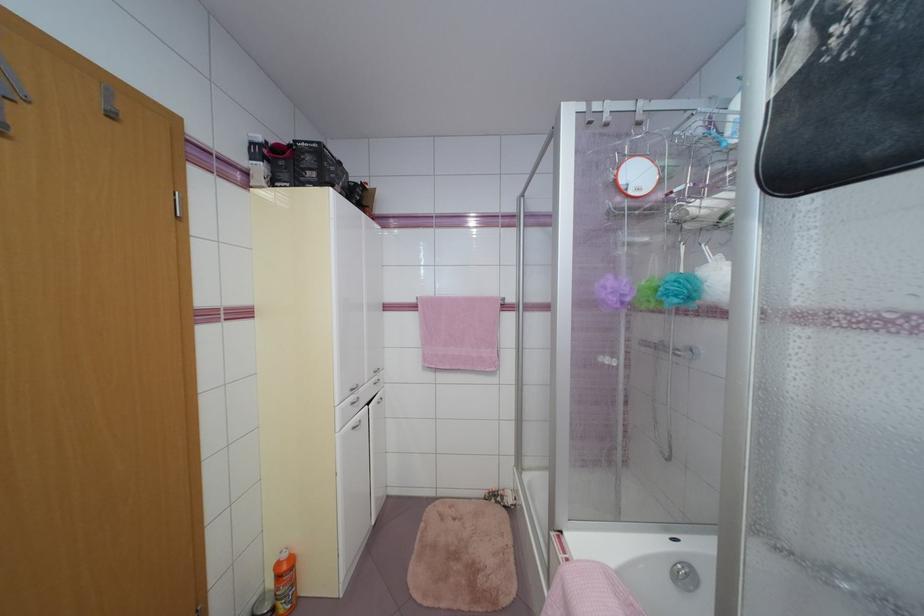
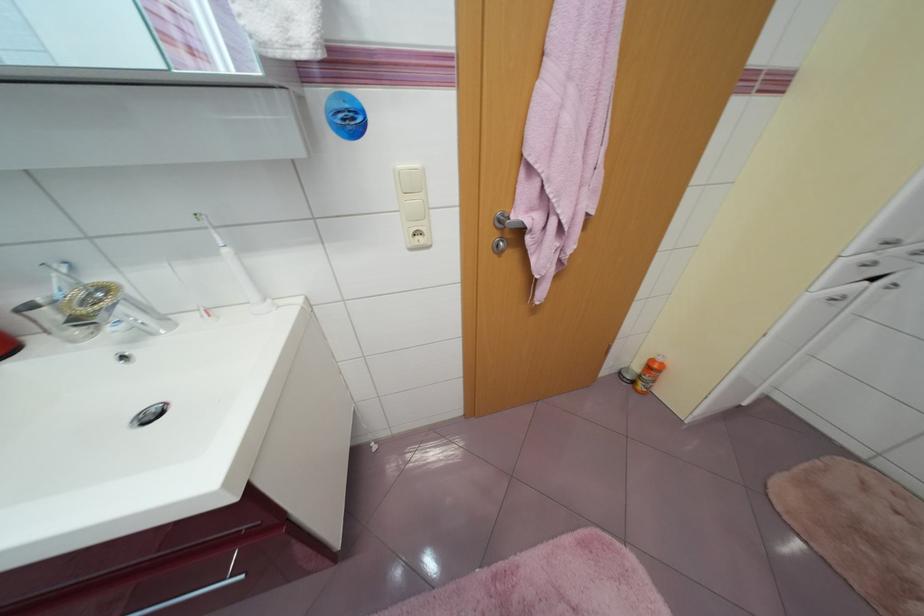
First-person continuous shooting, in which direction is the camera rotating?

The camera rotated toward left-down.